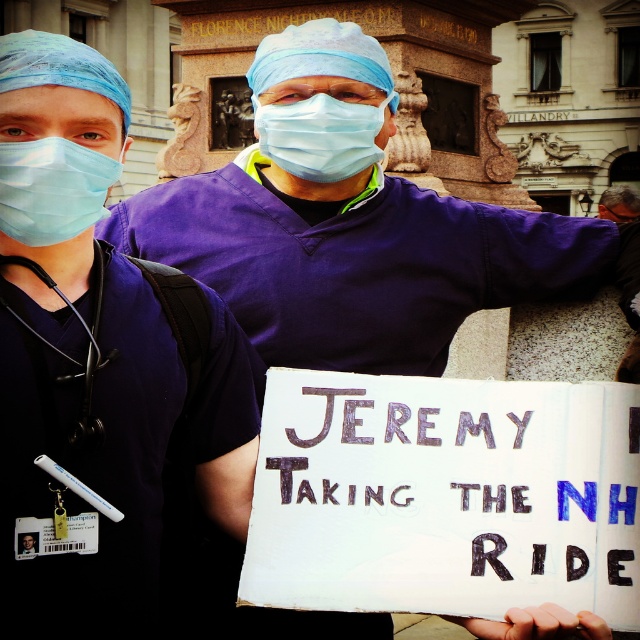
You are a medical student observing two masks in the scene. The first is the matte blue surgical mask at left and the second is the blue fabric mask at center. Which mask is located lower in the image?

The matte blue surgical mask at left is positioned under the blue fabric mask at center, so it is located lower in the image.

You are a medical student observing two masks in the scene. The first is the matte blue surgical mask at left, and the second is the blue fabric mask at center. Which of these two masks has a greater height?

The matte blue surgical mask at left is taller than the blue fabric mask at center.

You are a photographer taking a picture of the two people in the scene. You notice the matte blue surgical mask at left and the blue fabric mask at center. Which mask will appear more in focus if you focus on the person on the left?

The matte blue surgical mask at left will appear more in focus because it is in front of the blue fabric mask at center, so focusing on the person on the left would prioritize the mask at left in the focal plane.